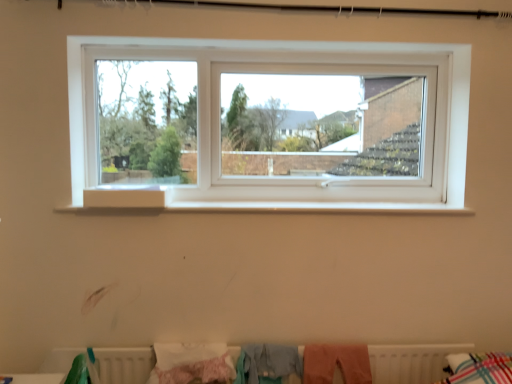
What is the approximate height of light blue fabric at lower center, placed as the 2th clothing when sorted from left to right?

9.42 inches.

This screenshot has width=512, height=384. I want to click on pink fluffy blanket at lower center, the first clothing in the left-to-right sequence, so click(191, 363).

Find the location of a particular element. light blue fabric at lower center, placed as the 2th clothing when sorted from left to right is located at coordinates (267, 363).

Locate an element on the screen. The height and width of the screenshot is (384, 512). radiator behind the light blue fabric at lower center, acting as the second clothing starting from the right is located at coordinates (411, 362).

From the image's perspective, would you say light blue fabric at lower center, placed as the 2th clothing when sorted from left to right, is positioned over white matte radiator at lower center?

Indeed, from the image's perspective, light blue fabric at lower center, placed as the 2th clothing when sorted from left to right, is shown above white matte radiator at lower center.

Measure the distance between light blue fabric at lower center, acting as the second clothing starting from the right, and white matte radiator at lower center.

light blue fabric at lower center, acting as the second clothing starting from the right, and white matte radiator at lower center are 52.56 centimeters apart from each other.

Is light blue fabric at lower center, acting as the second clothing starting from the right, positioned beyond the bounds of white matte radiator at lower center?

No, light blue fabric at lower center, acting as the second clothing starting from the right, is not outside of white matte radiator at lower center.

Between point (268, 374) and point (312, 347), which one is positioned in front?

The point (268, 374) is in front.

Considering the relative sizes of light blue fabric at lower center, acting as the second clothing starting from the right, and pink fabric at lower center, which is the 3th clothing from left to right, in the image provided, is light blue fabric at lower center, acting as the second clothing starting from the right, wider than pink fabric at lower center, which is the 3th clothing from left to right,?

Yes.

Considering the relative sizes of light blue fabric at lower center, placed as the 2th clothing when sorted from left to right, and pink fabric at lower center, which is the 3th clothing from left to right, in the image provided, is light blue fabric at lower center, placed as the 2th clothing when sorted from left to right, bigger than pink fabric at lower center, which is the 3th clothing from left to right,?

Yes, light blue fabric at lower center, placed as the 2th clothing when sorted from left to right, is bigger than pink fabric at lower center, which is the 3th clothing from left to right.

Who is taller, light blue fabric at lower center, placed as the 2th clothing when sorted from left to right, or pink fabric at lower center, which is counted as the 1th clothing, starting from the right?

With more height is light blue fabric at lower center, placed as the 2th clothing when sorted from left to right.

Is pink fabric at lower center, which is the 3th clothing from left to right, not close to light blue fabric at lower center, placed as the 2th clothing when sorted from left to right?

No, pink fabric at lower center, which is the 3th clothing from left to right, is not far away from light blue fabric at lower center, placed as the 2th clothing when sorted from left to right.

From a real-world perspective, between pink fabric at lower center, which is the 3th clothing from left to right, and light blue fabric at lower center, placed as the 2th clothing when sorted from left to right, who is vertically higher?

From a 3D spatial view, light blue fabric at lower center, placed as the 2th clothing when sorted from left to right, is above.

Is point (344, 351) in front of point (253, 355)?

That is False.

Who is taller, pink fabric at lower center, which is counted as the 1th clothing, starting from the right, or light blue fabric at lower center, placed as the 2th clothing when sorted from left to right?

light blue fabric at lower center, placed as the 2th clothing when sorted from left to right, is taller.

How different are the orientations of white matte radiator at lower center and pink fluffy blanket at lower center, the first clothing in the left-to-right sequence, in degrees?

0.541 degrees.

From a real-world perspective, is white matte radiator at lower center positioned over pink fluffy blanket at lower center, placed as the third clothing when sorted from right to left, based on gravity?

No.

Is white matte radiator at lower center far from pink fluffy blanket at lower center, placed as the third clothing when sorted from right to left?

No, white matte radiator at lower center is in close proximity to pink fluffy blanket at lower center, placed as the third clothing when sorted from right to left.

The image size is (512, 384). In the image, there is a pink fluffy blanket at lower center, the first clothing in the left-to-right sequence. Identify the location of radiator below it (from the image's perspective). (411, 362).

Which of these two, pink fluffy blanket at lower center, placed as the third clothing when sorted from right to left, or pink fabric at lower center, which is counted as the 1th clothing, starting from the right, is wider?

With larger width is pink fluffy blanket at lower center, placed as the third clothing when sorted from right to left.

Is pink fluffy blanket at lower center, placed as the third clothing when sorted from right to left, not within pink fabric at lower center, which is counted as the 1th clothing, starting from the right?

Indeed, pink fluffy blanket at lower center, placed as the third clothing when sorted from right to left, is completely outside pink fabric at lower center, which is counted as the 1th clothing, starting from the right.

From a real-world perspective, which object stands above the other?

pink fluffy blanket at lower center, the first clothing in the left-to-right sequence, is physically above.

Considering the relative positions of white matte radiator at lower center and pink fabric at lower center, which is the 3th clothing from left to right, in the image provided, is white matte radiator at lower center to the left of pink fabric at lower center, which is the 3th clothing from left to right, from the viewer's perspective?

Yes.

From the image's perspective, is white matte radiator at lower center on top of pink fabric at lower center, which is the 3th clothing from left to right?

Correct, white matte radiator at lower center appears higher than pink fabric at lower center, which is the 3th clothing from left to right, in the image.

Does point (57, 351) come behind point (315, 378)?

That is True.

Can we say white matte radiator at lower center lies outside pink fabric at lower center, which is the 3th clothing from left to right?

Absolutely, white matte radiator at lower center is external to pink fabric at lower center, which is the 3th clothing from left to right.

Considering the relative sizes of pink fabric at lower center, which is the 3th clothing from left to right, and white matte radiator at lower center in the image provided, is pink fabric at lower center, which is the 3th clothing from left to right, wider than white matte radiator at lower center?

Yes.

Could you tell me if pink fabric at lower center, which is the 3th clothing from left to right, is turned towards white matte radiator at lower center?

Yes.

From the picture: Is pink fabric at lower center, which is counted as the 1th clothing, starting from the right, in front of or behind white matte radiator at lower center in the image?

Visually, pink fabric at lower center, which is counted as the 1th clothing, starting from the right, is located behind white matte radiator at lower center.

In the image, there is a light blue fabric at lower center, placed as the 2th clothing when sorted from left to right. Identify the location of radiator below it (from a real-world perspective). This screenshot has height=384, width=512. (411, 362).

Image resolution: width=512 pixels, height=384 pixels. Find the location of `clothing that is the 2nd object located above the pink fabric at lower center, which is counted as the 1th clothing, starting from the right (from the image's perspective)`. clothing that is the 2nd object located above the pink fabric at lower center, which is counted as the 1th clothing, starting from the right (from the image's perspective) is located at coordinates (267, 363).

Estimate the real-world distances between objects in this image. Which object is further from white matte radiator at lower center, pink fabric at lower center, which is counted as the 1th clothing, starting from the right, or light blue fabric at lower center, placed as the 2th clothing when sorted from left to right?

Based on the image, pink fabric at lower center, which is counted as the 1th clothing, starting from the right, appears to be further to white matte radiator at lower center.

Looking at the image, which one is located closer to light blue fabric at lower center, placed as the 2th clothing when sorted from left to right, pink fabric at lower center, which is the 3th clothing from left to right, or pink fluffy blanket at lower center, the first clothing in the left-to-right sequence?

Among the two, pink fabric at lower center, which is the 3th clothing from left to right, is located nearer to light blue fabric at lower center, placed as the 2th clothing when sorted from left to right.

Considering their positions, is light blue fabric at lower center, acting as the second clothing starting from the right, positioned closer to pink fabric at lower center, which is counted as the 1th clothing, starting from the right, than white matte radiator at lower center?

light blue fabric at lower center, acting as the second clothing starting from the right, is positioned closer to the anchor pink fabric at lower center, which is counted as the 1th clothing, starting from the right.

Based on their spatial positions, is pink fluffy blanket at lower center, placed as the third clothing when sorted from right to left, or light blue fabric at lower center, placed as the 2th clothing when sorted from left to right, closer to white matte radiator at lower center?

pink fluffy blanket at lower center, placed as the third clothing when sorted from right to left, is positioned closer to the anchor white matte radiator at lower center.

Estimate the real-world distances between objects in this image. Which object is further from light blue fabric at lower center, placed as the 2th clothing when sorted from left to right, pink fabric at lower center, which is counted as the 1th clothing, starting from the right, or white matte radiator at lower center?

Based on the image, white matte radiator at lower center appears to be further to light blue fabric at lower center, placed as the 2th clothing when sorted from left to right.

Considering their positions, is pink fluffy blanket at lower center, the first clothing in the left-to-right sequence, positioned closer to light blue fabric at lower center, acting as the second clothing starting from the right, than white matte radiator at lower center?

The object closer to light blue fabric at lower center, acting as the second clothing starting from the right, is pink fluffy blanket at lower center, the first clothing in the left-to-right sequence.

When comparing their distances from white matte radiator at lower center, does light blue fabric at lower center, placed as the 2th clothing when sorted from left to right, or pink fluffy blanket at lower center, placed as the third clothing when sorted from right to left, seem further?

light blue fabric at lower center, placed as the 2th clothing when sorted from left to right, is further to white matte radiator at lower center.

Based on their spatial positions, is pink fluffy blanket at lower center, placed as the third clothing when sorted from right to left, or white matte radiator at lower center closer to pink fabric at lower center, which is the 3th clothing from left to right?

pink fluffy blanket at lower center, placed as the third clothing when sorted from right to left, is closer to pink fabric at lower center, which is the 3th clothing from left to right.

Where is `radiator between pink fluffy blanket at lower center, placed as the third clothing when sorted from right to left, and pink fabric at lower center, which is counted as the 1th clothing, starting from the right`? The height and width of the screenshot is (384, 512). radiator between pink fluffy blanket at lower center, placed as the third clothing when sorted from right to left, and pink fabric at lower center, which is counted as the 1th clothing, starting from the right is located at coordinates (411, 362).

Locate an element on the screen. This screenshot has height=384, width=512. clothing situated between white matte radiator at lower center and pink fabric at lower center, which is counted as the 1th clothing, starting from the right, from left to right is located at coordinates (267, 363).

Locate an element on the screen. radiator situated between pink fluffy blanket at lower center, placed as the third clothing when sorted from right to left, and light blue fabric at lower center, placed as the 2th clothing when sorted from left to right, from left to right is located at coordinates (x=411, y=362).

Locate an element on the screen. clothing between pink fluffy blanket at lower center, the first clothing in the left-to-right sequence, and pink fabric at lower center, which is the 3th clothing from left to right, from left to right is located at coordinates (x=267, y=363).